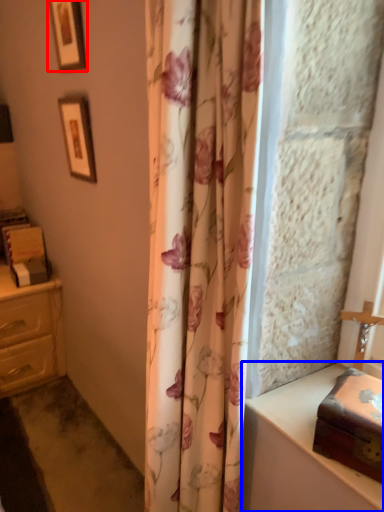
Question: Among these objects, which one is nearest to the camera, picture frame (highlighted by a red box) or vanity (highlighted by a blue box)?

Choices:
 (A) picture frame
 (B) vanity

Answer: (B)